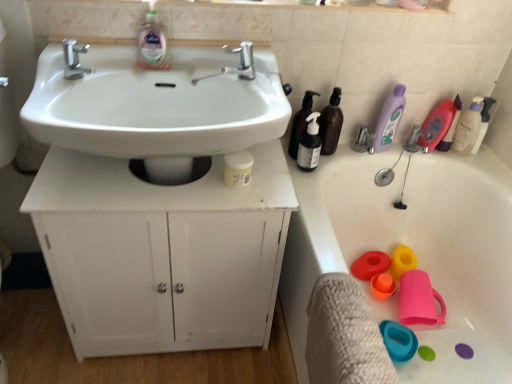
Identify the location of translucent plastic spray bottle at upper right, the fourth cleaning product when ordered from left to right. (451, 127).

Locate an element on the screen. The image size is (512, 384). white glossy sink at center is located at coordinates (156, 107).

Measure the distance between point (238, 170) and camera.

Point (238, 170) and camera are 38.74 inches apart from each other.

Measure the distance between white matte jar at center, arranged as the first toiletry when viewed from the front, and camera.

white matte jar at center, arranged as the first toiletry when viewed from the front, and camera are 38.71 inches apart from each other.

Measure the distance between textured white towel at lower right and camera.

29.02 inches.

The width and height of the screenshot is (512, 384). I want to click on textured white towel at lower right, so click(344, 335).

The width and height of the screenshot is (512, 384). In order to click on pink rubber cup at lower right, which ranks as the fourth toy in back-to-front order in this screenshot , I will do `click(419, 300)`.

Is there a large distance between pink plastic spray bottle at upper right, the third cleaning product when ordered from left to right, and polished chrome faucet at upper left, which is the second tap in right-to-left order?

That's right, there is a large distance between pink plastic spray bottle at upper right, the third cleaning product when ordered from left to right, and polished chrome faucet at upper left, which is the second tap in right-to-left order.

Does pink plastic spray bottle at upper right, arranged as the third cleaning product when viewed from the right, appear on the right side of polished chrome faucet at upper left, the 1th tap from the left?

Indeed, pink plastic spray bottle at upper right, arranged as the third cleaning product when viewed from the right, is positioned on the right side of polished chrome faucet at upper left, the 1th tap from the left.

Can polished chrome faucet at upper left, which is the second tap in right-to-left order, be found inside pink plastic spray bottle at upper right, the third cleaning product when ordered from left to right?

No, polished chrome faucet at upper left, which is the second tap in right-to-left order, is not a part of pink plastic spray bottle at upper right, the third cleaning product when ordered from left to right.

Looking at the image, does polished chrome tap at upper center, which appears as the 2th tap when viewed from the left, seem bigger or smaller compared to white pump bottle at upper right, placed as the fifth cleaning product when sorted from left to right?

polished chrome tap at upper center, which appears as the 2th tap when viewed from the left, is smaller than white pump bottle at upper right, placed as the fifth cleaning product when sorted from left to right.

Is white pump bottle at upper right, the 1th cleaning product in the right-to-left sequence, surrounded by polished chrome tap at upper center, which appears as the 2th tap when viewed from the left?

Actually, white pump bottle at upper right, the 1th cleaning product in the right-to-left sequence, is outside polished chrome tap at upper center, which appears as the 2th tap when viewed from the left.

What's the angular difference between polished chrome tap at upper center, which ranks as the 1th tap in right-to-left order, and white pump bottle at upper right, the 1th cleaning product in the right-to-left sequence,'s facing directions?

0.53 degrees.

Considering the positions of objects polished chrome tap at upper center, which appears as the 2th tap when viewed from the left, and white pump bottle at upper right, the 1th cleaning product in the right-to-left sequence, in the image provided, who is more to the left, polished chrome tap at upper center, which appears as the 2th tap when viewed from the left, or white pump bottle at upper right, the 1th cleaning product in the right-to-left sequence,?

Positioned to the left is polished chrome tap at upper center, which appears as the 2th tap when viewed from the left.

Do you think purple translucent bottle at upper right, arranged as the fourth cleaning product when viewed from the right, is within orange matte cup at lower right, the third toy in the back-to-front sequence, or outside of it?

purple translucent bottle at upper right, arranged as the fourth cleaning product when viewed from the right, is spatially situated outside orange matte cup at lower right, the third toy in the back-to-front sequence.

Which is less distant, (395, 132) or (388, 285)?

Point (395, 132)

Considering the sizes of purple translucent bottle at upper right, which is the 2th cleaning product in left-to-right order, and orange matte cup at lower right, placed as the 2th toy when sorted from front to back, in the image, is purple translucent bottle at upper right, which is the 2th cleaning product in left-to-right order, wider or thinner than orange matte cup at lower right, placed as the 2th toy when sorted from front to back,?

Clearly, purple translucent bottle at upper right, which is the 2th cleaning product in left-to-right order, has less width compared to orange matte cup at lower right, placed as the 2th toy when sorted from front to back.

Can you tell me how much purple translucent bottle at upper right, arranged as the fourth cleaning product when viewed from the right, and orange matte cup at lower right, placed as the 2th toy when sorted from front to back, differ in facing direction?

99.2 degrees.

From a real-world perspective, who is located lower, translucent dark brown pump bottle at upper right, which appears as the first toiletry when viewed from the right, or translucent plastic spray bottle at upper right, the fourth cleaning product when ordered from left to right?

translucent plastic spray bottle at upper right, the fourth cleaning product when ordered from left to right.

What's the angular difference between translucent dark brown pump bottle at upper right, which appears as the first toiletry when viewed from the right, and translucent plastic spray bottle at upper right, which is counted as the second cleaning product, starting from the right,'s facing directions?

There is a 5.57-degree angle between the facing directions of translucent dark brown pump bottle at upper right, which appears as the first toiletry when viewed from the right, and translucent plastic spray bottle at upper right, which is counted as the second cleaning product, starting from the right.

In terms of width, does translucent dark brown pump bottle at upper right, acting as the second toiletry starting from the left, look wider or thinner when compared to translucent plastic spray bottle at upper right, which is counted as the second cleaning product, starting from the right?

Clearly, translucent dark brown pump bottle at upper right, acting as the second toiletry starting from the left, has more width compared to translucent plastic spray bottle at upper right, which is counted as the second cleaning product, starting from the right.

In terms of height, does translucent dark brown pump bottle at upper right, arranged as the 2th toiletry when ordered from the bottom, look taller or shorter compared to translucent plastic spray bottle at upper right, the fourth cleaning product when ordered from left to right?

translucent dark brown pump bottle at upper right, arranged as the 2th toiletry when ordered from the bottom, is taller than translucent plastic spray bottle at upper right, the fourth cleaning product when ordered from left to right.

Is textured white towel at lower right inside or outside of white matte cabinet at center?

textured white towel at lower right exists outside the volume of white matte cabinet at center.

How much distance is there between textured white towel at lower right and white matte cabinet at center?

textured white towel at lower right and white matte cabinet at center are 14.96 inches apart from each other.

Between textured white towel at lower right and white matte cabinet at center, which one is positioned behind?

white matte cabinet at center is further from the camera.

Consider the image. Is white pump bottle at upper right, the 1th cleaning product in the right-to-left sequence, to the right of textured white towel at lower right from the viewer's perspective?

Indeed, white pump bottle at upper right, the 1th cleaning product in the right-to-left sequence, is positioned on the right side of textured white towel at lower right.

Considering the points (464, 125) and (340, 317), which point is in front, point (464, 125) or point (340, 317)?

The point (340, 317) is more forward.

Which object is closer to the camera taking this photo, white pump bottle at upper right, the 1th cleaning product in the right-to-left sequence, or textured white towel at lower right?

Positioned in front is textured white towel at lower right.

In the scene shown: From a real-world perspective, is pink plastic spray bottle at upper right, arranged as the third cleaning product when viewed from the right, above or below textured white towel at lower right?

From a real-world perspective, pink plastic spray bottle at upper right, arranged as the third cleaning product when viewed from the right, is physically above textured white towel at lower right.

Looking at this image, how far apart are pink plastic spray bottle at upper right, the third cleaning product when ordered from left to right, and textured white towel at lower right?

pink plastic spray bottle at upper right, the third cleaning product when ordered from left to right, is 29.20 inches away from textured white towel at lower right.

Is pink plastic spray bottle at upper right, arranged as the third cleaning product when viewed from the right, looking in the opposite direction of textured white towel at lower right?

No, pink plastic spray bottle at upper right, arranged as the third cleaning product when viewed from the right,'s orientation is not away from textured white towel at lower right.

Is pink plastic spray bottle at upper right, arranged as the third cleaning product when viewed from the right, next to textured white towel at lower right?

No, pink plastic spray bottle at upper right, arranged as the third cleaning product when viewed from the right, is not with textured white towel at lower right.

What are the coordinates of `tap that is the 1st one when counting upward from the pink plastic spray bottle at upper right, the third cleaning product when ordered from left to right (from the image's perspective)` in the screenshot? It's located at (74, 59).

Find the location of a particular element. Image resolution: width=512 pixels, height=384 pixels. the 5th cleaning product behind the polished chrome tap at upper center, which appears as the 2th tap when viewed from the left, starting your count from the anchor is located at coordinates (468, 128).

Looking at this image, which object lies nearer to the anchor point purple translucent bottle at upper right, arranged as the fourth cleaning product when viewed from the right, pink plastic spray bottle at upper right, arranged as the third cleaning product when viewed from the right, or white pump bottle at upper right, placed as the fifth cleaning product when sorted from left to right?

The object closer to purple translucent bottle at upper right, arranged as the fourth cleaning product when viewed from the right, is pink plastic spray bottle at upper right, arranged as the third cleaning product when viewed from the right.

Considering their positions, is white glossy sink at center positioned closer to polished chrome tap at upper center, which ranks as the 1th tap in right-to-left order, than pink rubber cup at lower right, which is counted as the fourth toy, starting from the front?

white glossy sink at center is closer to polished chrome tap at upper center, which ranks as the 1th tap in right-to-left order.

From the image, which object appears to be farther from polished chrome faucet at upper left, the 1th tap from the left, white matte cabinet at center or pink rubber cup at lower right, arranged as the 1th toy when viewed from the back?

Based on the image, pink rubber cup at lower right, arranged as the 1th toy when viewed from the back, appears to be further to polished chrome faucet at upper left, the 1th tap from the left.

Looking at the image, which one is located closer to matte red plastic toy at lower right, the second toy from the back, purple translucent bottle at upper right, which is the 2th cleaning product in left-to-right order, or textured white towel at lower right?

purple translucent bottle at upper right, which is the 2th cleaning product in left-to-right order.

Estimate the real-world distances between objects in this image. Which object is further from white pump bottle at upper right, the 1th cleaning product in the right-to-left sequence, clear liquid soap at upper center, acting as the 1th cleaning product starting from the left, or orange matte cup at lower right, placed as the 2th toy when sorted from front to back?

clear liquid soap at upper center, acting as the 1th cleaning product starting from the left.

From the image, which object appears to be nearer to purple translucent bottle at upper right, arranged as the fourth cleaning product when viewed from the right, translucent plastic spray bottle at upper right, which is counted as the second cleaning product, starting from the right, or matte red plastic toy at lower right, the second toy from the back?

translucent plastic spray bottle at upper right, which is counted as the second cleaning product, starting from the right.

Based on their spatial positions, is pink rubber cup at lower right, which is counted as the fourth toy, starting from the front, or pink plastic spray bottle at upper right, arranged as the third cleaning product when viewed from the right, closer to polished chrome tap at upper center, which ranks as the 1th tap in right-to-left order?

pink plastic spray bottle at upper right, arranged as the third cleaning product when viewed from the right, is closer to polished chrome tap at upper center, which ranks as the 1th tap in right-to-left order.

When comparing their distances from pink plastic spray bottle at upper right, arranged as the third cleaning product when viewed from the right, does white matte cabinet at center or white glossy sink at center seem further?

white matte cabinet at center is further to pink plastic spray bottle at upper right, arranged as the third cleaning product when viewed from the right.

This screenshot has height=384, width=512. Identify the location of bath located between white glossy sink at center and pink rubber cup at lower right, which is counted as the fourth toy, starting from the front, in the left-right direction. (413, 250).

Identify the location of tap situated between polished chrome faucet at upper left, which is the second tap in right-to-left order, and pink rubber cup at lower right, which is counted as the fourth toy, starting from the front, from left to right. The height and width of the screenshot is (384, 512). (242, 61).

Identify the location of cleaning product between white matte jar at center, which is counted as the 2th toiletry, starting from the top, and pink rubber cup at lower right, arranged as the 1th toy when viewed from the front. (388, 120).

The height and width of the screenshot is (384, 512). In order to click on bath between polished chrome faucet at upper left, the 1th tap from the left, and pink rubber cup at lower right, arranged as the 1th toy when viewed from the front, from left to right in this screenshot , I will do click(413, 250).